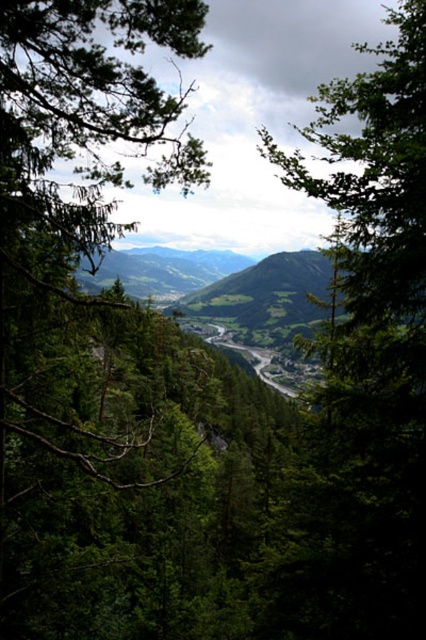
Question: Can you confirm if green leafy tree at center is positioned above green leafy tree at left?

Choices:
 (A) yes
 (B) no

Answer: (A)

Question: Which point is closer to the camera taking this photo?

Choices:
 (A) (8, 4)
 (B) (288, 568)

Answer: (A)

Question: Is green leafy tree at center thinner than green leafy tree at left?

Choices:
 (A) yes
 (B) no

Answer: (B)

Question: Which point is closer to the camera taking this photo?

Choices:
 (A) (333, 401)
 (B) (155, 116)

Answer: (A)

Question: Can you confirm if green leafy tree at center is wider than green leafy tree at left?

Choices:
 (A) yes
 (B) no

Answer: (A)